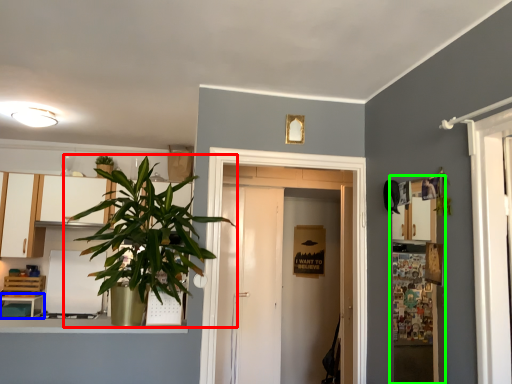
Question: Which is nearer to the houseplant (highlighted by a red box)? table (highlighted by a blue box) or shelf (highlighted by a green box).

Choices:
 (A) table
 (B) shelf

Answer: (A)